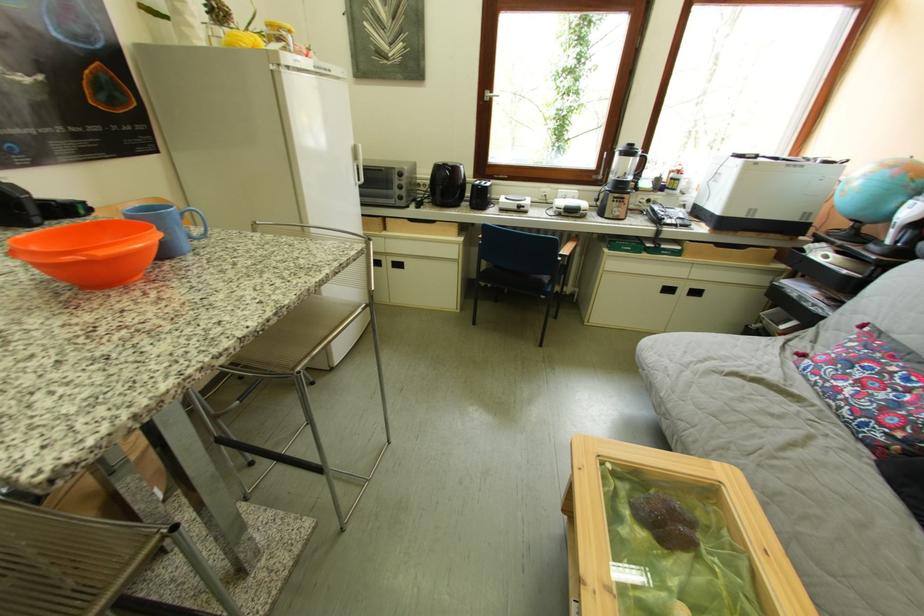
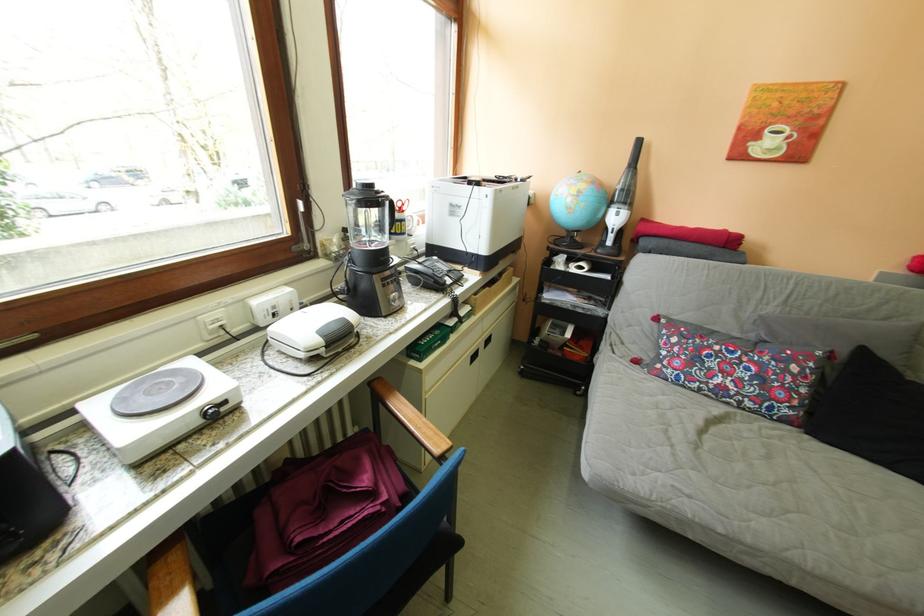
The point at (877, 177) is marked in the first image. Where is the corresponding point in the second image?

(591, 195)